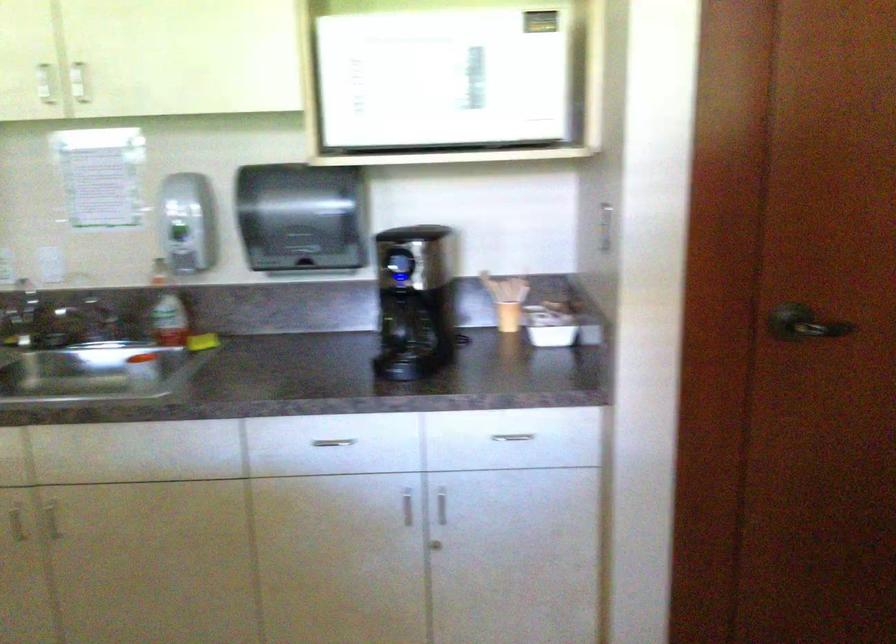
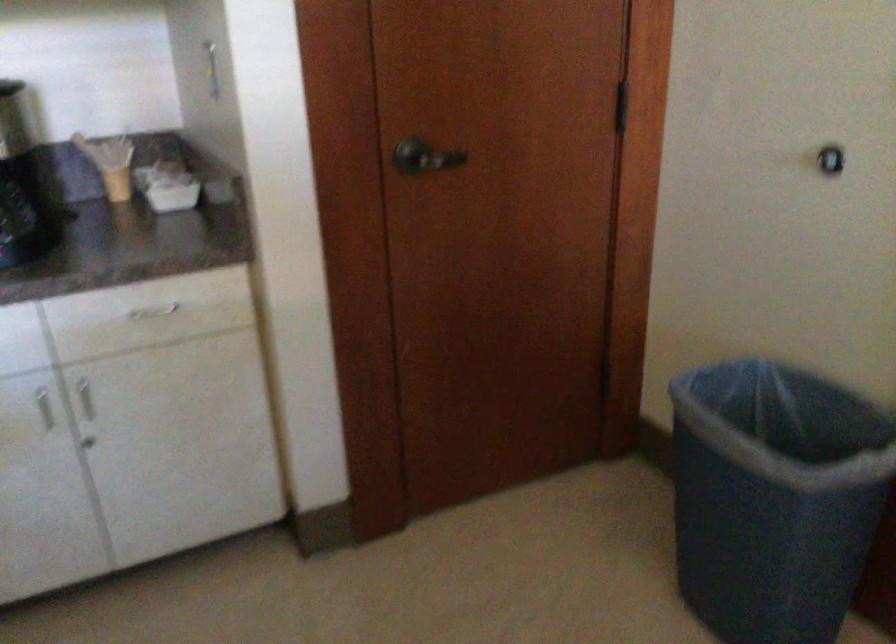
Question: Based on the continuous images, in which direction is the camera rotating? Reply with the corresponding letter.

Choices:
 (A) Left
 (B) Right
 (C) Up
 (D) Down

Answer: (B)